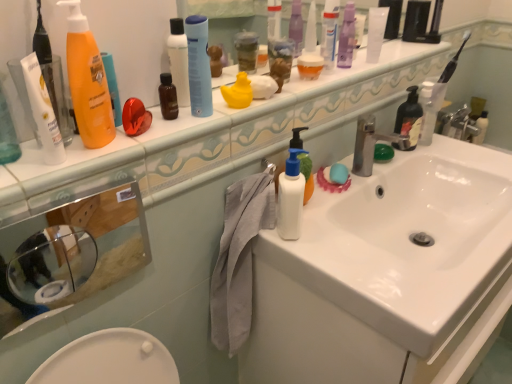
Image resolution: width=512 pixels, height=384 pixels. I want to click on blue matte spray can at upper center, placed as the second cleaning product when sorted from left to right, so click(199, 66).

What do you see at coordinates (409, 118) in the screenshot? I see `black matte soap dispenser at right, the 5th toiletry positioned from the front` at bounding box center [409, 118].

Image resolution: width=512 pixels, height=384 pixels. Describe the element at coordinates (42, 112) in the screenshot. I see `matte white tube at upper left, which is counted as the first toiletry, starting from the front` at that location.

Describe the element at coordinates (215, 133) in the screenshot. The width and height of the screenshot is (512, 384). I see `white glossy sink at upper center` at that location.

From the picture: What is the approximate width of white glossy sink at upper center?

It is 18.42 centimeters.

At what (x,y) coordinates should I click in order to perform the action: click on white glossy sink at center. Please return your answer as a coordinate pair (x, y). Image resolution: width=512 pixels, height=384 pixels. Looking at the image, I should click on (406, 241).

Describe the element at coordinates (457, 124) in the screenshot. I see `silver metallic faucet at upper right` at that location.

You are a GUI agent. You are given a task and a screenshot of the screen. Output one action in this format:
    pyautogui.click(x=<x>, y=<y>)
    Task: Click on the silver metallic faucet at upper right
    This screenshot has height=384, width=512.
    Given the screenshot: What is the action you would take?
    pyautogui.click(x=457, y=124)

Locate an element on the screen. This screenshot has width=512, height=384. blue matte spray can at upper center, marked as the 2th cleaning product in a back-to-front arrangement is located at coordinates (199, 66).

Does point (441, 120) come behind point (75, 181)?

That is True.

In the scene shown: Is silver metallic faucet at upper right bigger or smaller than white glossy sink at upper center?

Clearly, silver metallic faucet at upper right is smaller in size than white glossy sink at upper center.

Would you say silver metallic faucet at upper right is a long distance from white glossy sink at upper center?

silver metallic faucet at upper right is positioned a significant distance from white glossy sink at upper center.

Considering the relative sizes of silver metallic faucet at upper right and white glossy sink at upper center in the image provided, is silver metallic faucet at upper right wider than white glossy sink at upper center?

Incorrect, the width of silver metallic faucet at upper right does not surpass that of white glossy sink at upper center.

Looking at their sizes, would you say white plastic toothbrush at right, placed as the 1th toiletry when sorted from right to left, is wider or thinner than blue matte soap at sink?

In the image, white plastic toothbrush at right, placed as the 1th toiletry when sorted from right to left, appears to be wider than blue matte soap at sink.

Is point (482, 131) closer or farther from the camera than point (346, 174)?

Point (482, 131) is farther from the camera than point (346, 174).

In terms of height, does white plastic toothbrush at right, which is the seventh toiletry from left to right, look taller or shorter compared to blue matte soap at sink?

Considering their sizes, white plastic toothbrush at right, which is the seventh toiletry from left to right, has more height than blue matte soap at sink.

Would you say white glossy sink at center contains white glossy sink at upper center?

Actually, white glossy sink at upper center is outside white glossy sink at center.

Considering their positions, is white glossy sink at center located in front of or behind white glossy sink at upper center?

white glossy sink at center is behind white glossy sink at upper center.

Consider the image. From the image's perspective, is white glossy sink at center beneath white glossy sink at upper center?

Yes, from the image's perspective, white glossy sink at center is beneath white glossy sink at upper center.

Between white glossy sink at center and white glossy sink at upper center, which one appears on the right side from the viewer's perspective?

From the viewer's perspective, white glossy sink at center appears more on the right side.

Which is closer, (84, 270) or (444, 113)?

The point (84, 270) is closer to the camera.

Is the position of transparent glass mirror at upper left more distant than that of silver metallic faucet at upper right?

No.

How much distance is there between transparent glass mirror at upper left and silver metallic faucet at upper right?

transparent glass mirror at upper left is 5.85 feet from silver metallic faucet at upper right.

Find the location of a particular element. The width and height of the screenshot is (512, 384). faucet below the silver metallic faucet at sink right (from a real-world perspective) is located at coordinates (457, 124).

Between silver metallic faucet at sink right and silver metallic faucet at upper right, which one has larger width?

silver metallic faucet at sink right.

From a real-world perspective, is silver metallic faucet at sink right on top of silver metallic faucet at upper right?

Yes, from a real-world perspective, silver metallic faucet at sink right is over silver metallic faucet at upper right

How much distance is there between silver metallic faucet at sink right and silver metallic faucet at upper right?

They are 36.66 inches apart.

From the image's perspective, count 1st cleaning products downward from the translucent plastic bottle at upper right, arranged as the 3th cleaning product when viewed from the left, and point to it. Please provide its 2D coordinates.

[(199, 66)]

Which is more to the right, blue matte spray can at upper center, which is counted as the 2th cleaning product, starting from the right, or translucent plastic bottle at upper right, the first cleaning product in the right-to-left sequence?

From the viewer's perspective, translucent plastic bottle at upper right, the first cleaning product in the right-to-left sequence, appears more on the right side.

Is blue matte spray can at upper center, placed as the second cleaning product when sorted from left to right, in contact with translucent plastic bottle at upper right, the first cleaning product positioned from the back?

No, blue matte spray can at upper center, placed as the second cleaning product when sorted from left to right, is not with translucent plastic bottle at upper right, the first cleaning product positioned from the back.

From a real-world perspective, is blue matte spray can at upper center, marked as the 2th cleaning product in a back-to-front arrangement, physically located above or below translucent plastic bottle at upper right, placed as the third cleaning product when sorted from front to back?

blue matte spray can at upper center, marked as the 2th cleaning product in a back-to-front arrangement, is above translucent plastic bottle at upper right, placed as the third cleaning product when sorted from front to back.

From the image's perspective, is translucent plastic container at upper center, which is the third toiletry from left to right, on top of gray fabric towel at center?

Indeed, from the image's perspective, translucent plastic container at upper center, which is the third toiletry from left to right, is shown above gray fabric towel at center.

Can you tell me how much translucent plastic container at upper center, which is counted as the 5th toiletry, starting from the back, and gray fabric towel at center differ in facing direction?

The angular difference between translucent plastic container at upper center, which is counted as the 5th toiletry, starting from the back, and gray fabric towel at center is 1.97 degrees.

Could you tell me if translucent plastic container at upper center, which is counted as the 5th toiletry, starting from the back, is turned towards gray fabric towel at center?

No, translucent plastic container at upper center, which is counted as the 5th toiletry, starting from the back, is not oriented towards gray fabric towel at center.

Is translucent plastic container at upper center, which appears as the 3th toiletry when viewed from the front, thinner than gray fabric towel at center?

Correct, the width of translucent plastic container at upper center, which appears as the 3th toiletry when viewed from the front, is less than that of gray fabric towel at center.

There is a silver metallic faucet at upper right. Where is `counter top above it (from a real-world perspective)`? This screenshot has height=384, width=512. counter top above it (from a real-world perspective) is located at coordinates (215, 133).

Find the location of a particular element. The image size is (512, 384). toiletry below the blue matte soap at sink (from a real-world perspective) is located at coordinates (481, 128).

When comparing their distances from white glossy sink at center, does white glossy tube at upper center, the 3th toiletry viewed from the right, or blue matte soap at sink seem closer?

blue matte soap at sink is positioned closer to the anchor white glossy sink at center.

Based on their spatial positions, is blue matte spray can at upper center, placed as the second cleaning product when sorted from left to right, or white glossy tube at upper center, marked as the fifth toiletry in a left-to-right arrangement, closer to translucent plastic bottle at upper right, arranged as the 3th cleaning product when viewed from the left?

white glossy tube at upper center, marked as the fifth toiletry in a left-to-right arrangement, is closer to translucent plastic bottle at upper right, arranged as the 3th cleaning product when viewed from the left.

From the image, which object appears to be farther from translucent plastic container at upper center, which appears as the 3th toiletry when viewed from the front, black matte soap dispenser at right, the second toiletry positioned from the right, or gray fabric towel at center?

Among the two, gray fabric towel at center is located further to translucent plastic container at upper center, which appears as the 3th toiletry when viewed from the front.

When comparing their distances from blue matte soap at sink, does orange matte bottle at upper left, the first cleaning product viewed from the left, or white matte plastic bottle at center seem further?

orange matte bottle at upper left, the first cleaning product viewed from the left.

Looking at the image, which one is located further to purple glossy bottle at upper center, acting as the 4th toiletry starting from the right, silver metallic faucet at sink right or silver metallic faucet at upper right?

The object further to purple glossy bottle at upper center, acting as the 4th toiletry starting from the right, is silver metallic faucet at upper right.

When comparing their distances from orange matte bottle at upper left, the third cleaning product in the back-to-front sequence, does silver metallic faucet at sink right or silver metallic faucet at upper right seem closer?

Among the two, silver metallic faucet at sink right is located nearer to orange matte bottle at upper left, the third cleaning product in the back-to-front sequence.

When comparing their distances from purple glossy bottle at upper center, acting as the 4th toiletry starting from the right, does silver metallic faucet at upper right or black matte soap dispenser at right, the second toiletry positioned from the right, seem closer?

black matte soap dispenser at right, the second toiletry positioned from the right.

Looking at the image, which one is located further to white glossy sink at upper center, matte white tube at upper left, which is counted as the first toiletry, starting from the front, or orange matte bottle at upper left, the first cleaning product viewed from the left?

The object further to white glossy sink at upper center is matte white tube at upper left, which is counted as the first toiletry, starting from the front.

Locate an element on the screen. The height and width of the screenshot is (384, 512). tap located between white matte plastic bottle at center and blue matte soap at sink in the depth direction is located at coordinates (371, 144).

At what (x,y) coordinates should I click in order to perform the action: click on soap between matte white tube at upper left, which ranks as the 1th toiletry in left-to-right order, and black matte soap dispenser at right, the sixth toiletry in the left-to-right sequence, from left to right. Please return your answer as a coordinate pair (x, y). The height and width of the screenshot is (384, 512). Looking at the image, I should click on (338, 174).

Identify the location of mouthwash between orange matte bottle at upper left, the first cleaning product viewed from the left, and gray fabric towel at center in the up-down direction. This screenshot has height=384, width=512. (291, 197).

I want to click on toiletry between orange matte bottle at upper left, the third cleaning product in the back-to-front sequence, and transparent glass mirror at upper left in the up-down direction, so (42, 112).